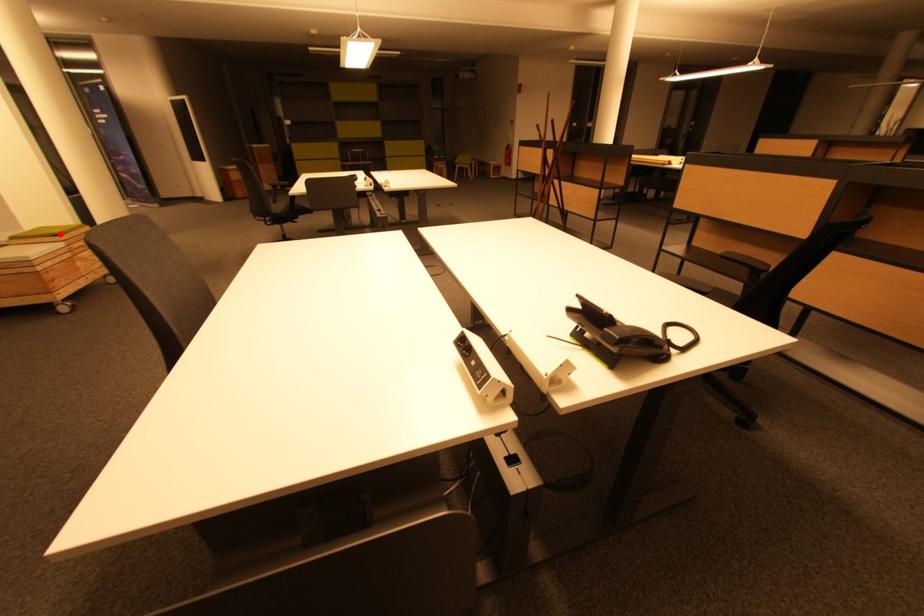
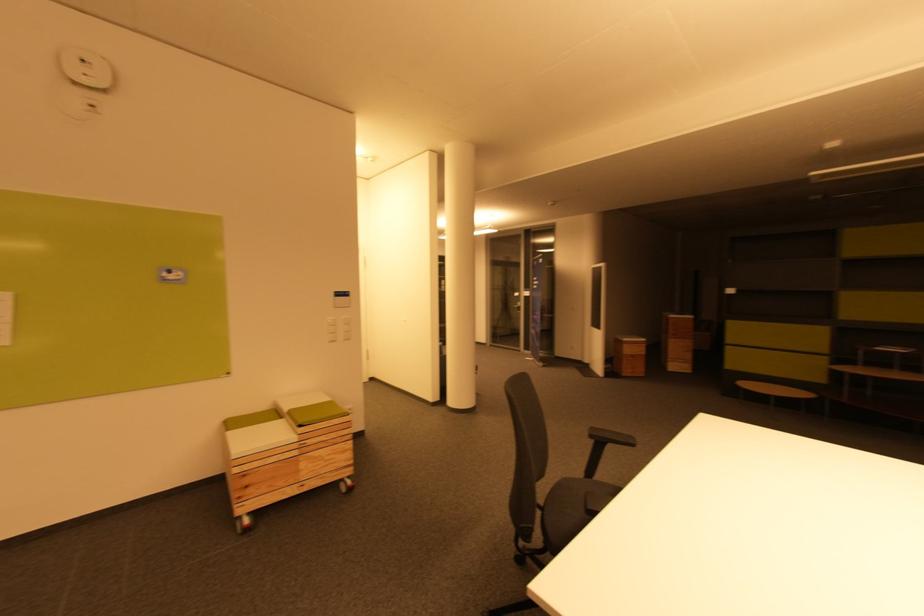
Question: I am providing you with two images of the same scene from different viewpoints. Given a red point in image1, look at the same physical point in image2. Is it:

Choices:
 (A) Closer to the viewpoint
 (B) Farther from the viewpoint

Answer: (A)